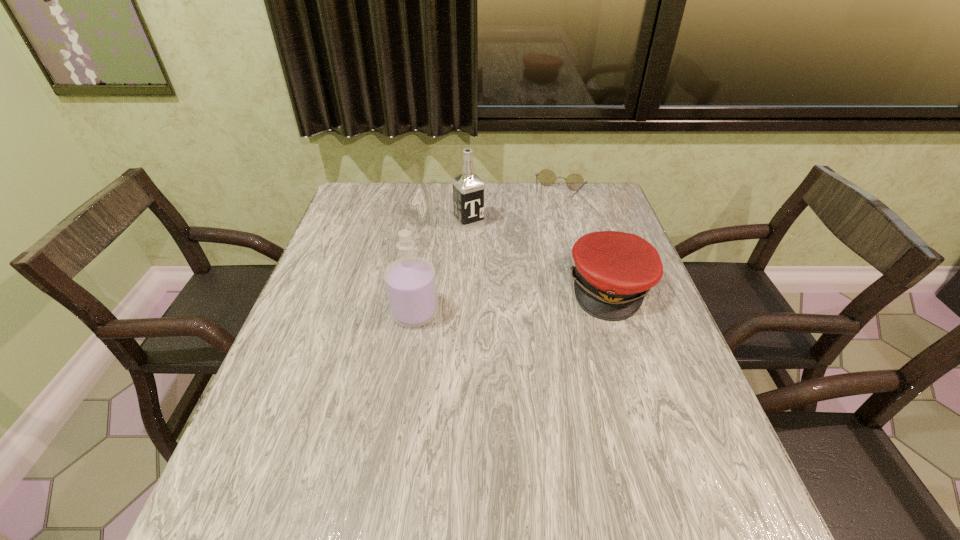
What are the coordinates of `empty space between the third tallest object and the second farthest object` in the screenshot? It's located at (x=540, y=255).

Find the location of a particular element. free space between the perfume and the second shortest object is located at coordinates (513, 300).

Where is `vacant space that is in between the leftmost object and the farthest object`? This screenshot has width=960, height=540. vacant space that is in between the leftmost object and the farthest object is located at coordinates (488, 254).

The image size is (960, 540). In order to click on the closest object to the third object from right to left in this screenshot , I will do `click(575, 182)`.

Identify which object is located as the third nearest to the spectacles. Please provide its 2D coordinates. Your answer should be formatted as a tuple, i.e. [(x, y)], where the tuple contains the x and y coordinates of a point satisfying the conditions above.

[(410, 282)]

The height and width of the screenshot is (540, 960). What are the coordinates of `vacant position in the image that satisfies the following two spatial constraints: 1. on the back side of the farthest object; 2. on the left side of the perfume` in the screenshot? It's located at (433, 196).